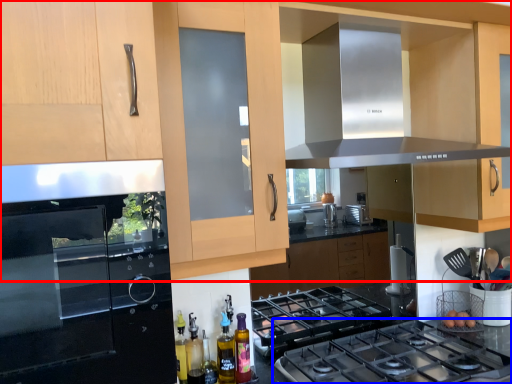
Question: Among these objects, which one is farthest to the camera, cabinetry (highlighted by a red box) or gas stove (highlighted by a blue box)?

Choices:
 (A) cabinetry
 (B) gas stove

Answer: (B)